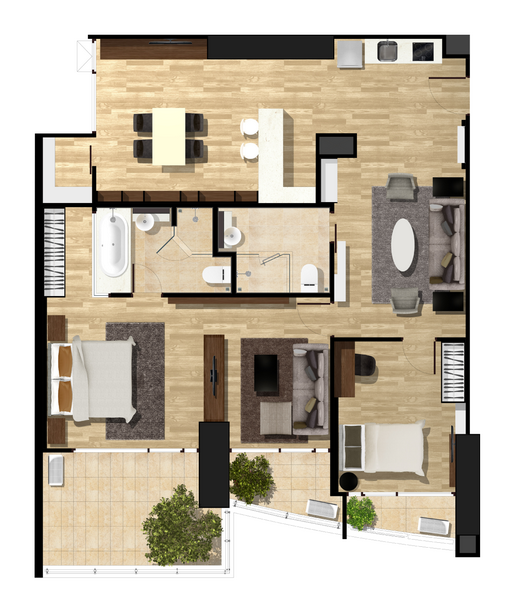
Locate an element on the screen. glass is located at coordinates point(317,509).